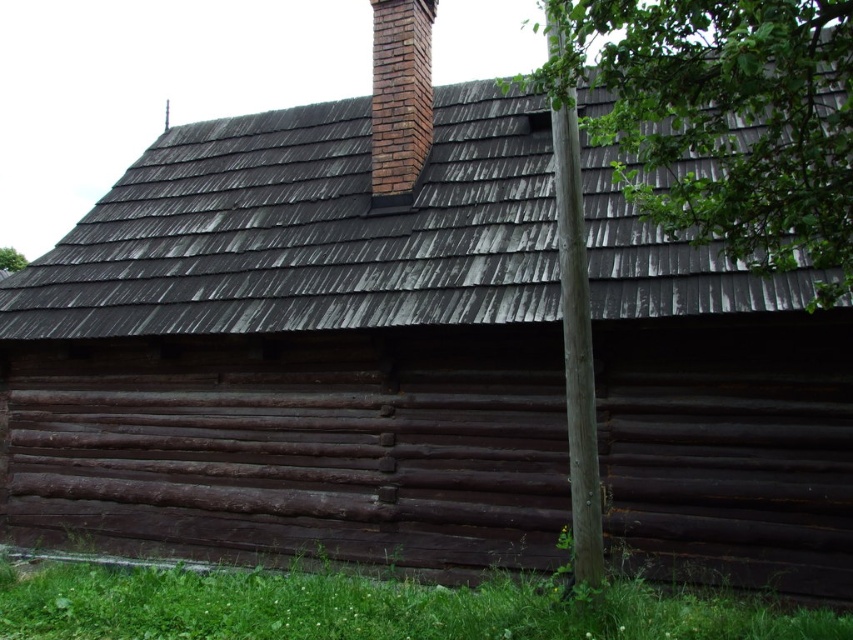
Question: Is green leafy tree at upper right to the right of green leafy tree at upper left from the viewer's perspective?

Choices:
 (A) yes
 (B) no

Answer: (A)

Question: Which object is positioned farthest from the smooth brown pole at center right?

Choices:
 (A) brick chimney at upper center
 (B) green leafy tree at upper left

Answer: (B)

Question: Which point appears closest to the camera in this image?

Choices:
 (A) pyautogui.click(x=16, y=253)
 (B) pyautogui.click(x=396, y=22)
 (C) pyautogui.click(x=585, y=289)

Answer: (C)

Question: Does smooth brown pole at center right have a smaller size compared to green leafy tree at upper left?

Choices:
 (A) yes
 (B) no

Answer: (B)

Question: Which object is positioned closest to the green leafy tree at upper left?

Choices:
 (A) brick chimney at upper center
 (B) smooth brown pole at center right

Answer: (A)

Question: Is green leafy tree at upper right positioned in front of green leafy tree at upper left?

Choices:
 (A) yes
 (B) no

Answer: (A)